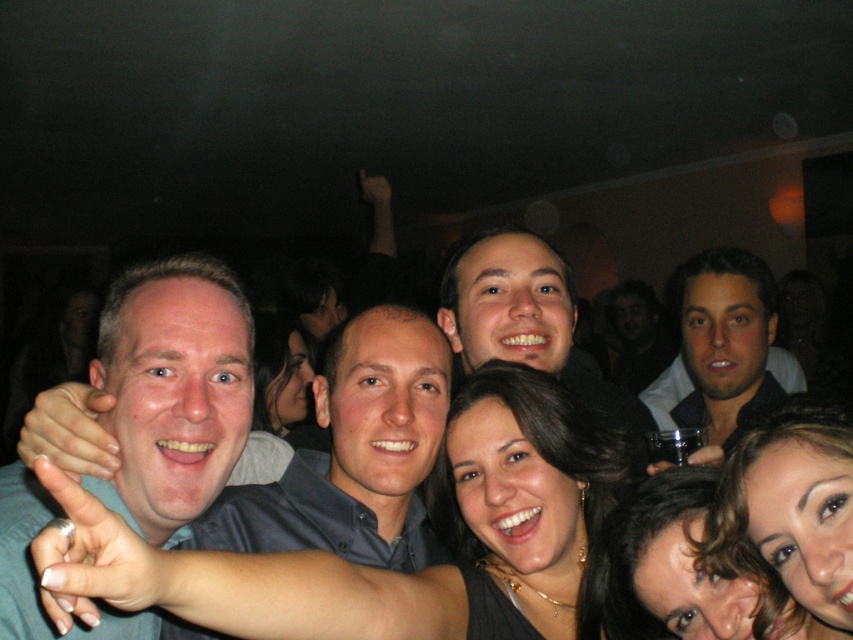
You are a photographer at the party and want to adjust your camera focus. Since the matte gray shirt at center and the smooth skin face at center are in the same frame, which one should you focus on first to ensure the face is sharp?

The smooth skin face at center should be focused on first because the matte gray shirt at center is located below it, making the face the primary subject closer to the camera.

You are a photographer trying to adjust the focus of your camera. You want to ensure both the matte gray shirt at center and the smooth skin face at center are in focus. Given that your camera has a depth of field that can cover 20 inches, will both objects be in focus?

The distance between the matte gray shirt at center and the smooth skin face at center is 19.82 inches, which is within the camera depth of field of 20 inches. Therefore, both objects will be in focus.

You are a photographer at the party and want to ensure that both the smooth skin face at center and the smooth black hair at center are visible in your portrait. Based on their positions, which one should you focus on first to ensure proper framing?

The smooth skin face at center is located above the smooth black hair at center, so you should focus on the smooth skin face at center first to ensure proper framing.